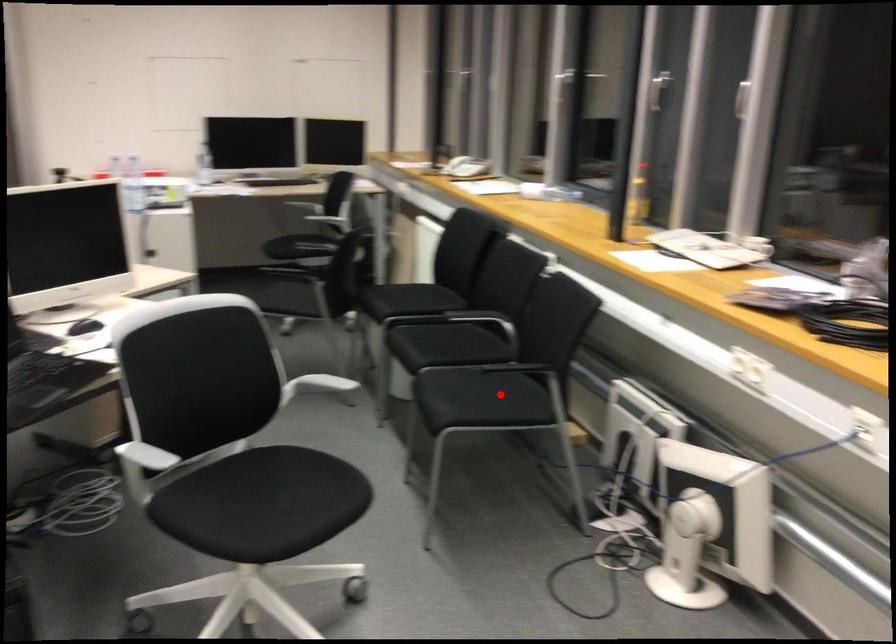
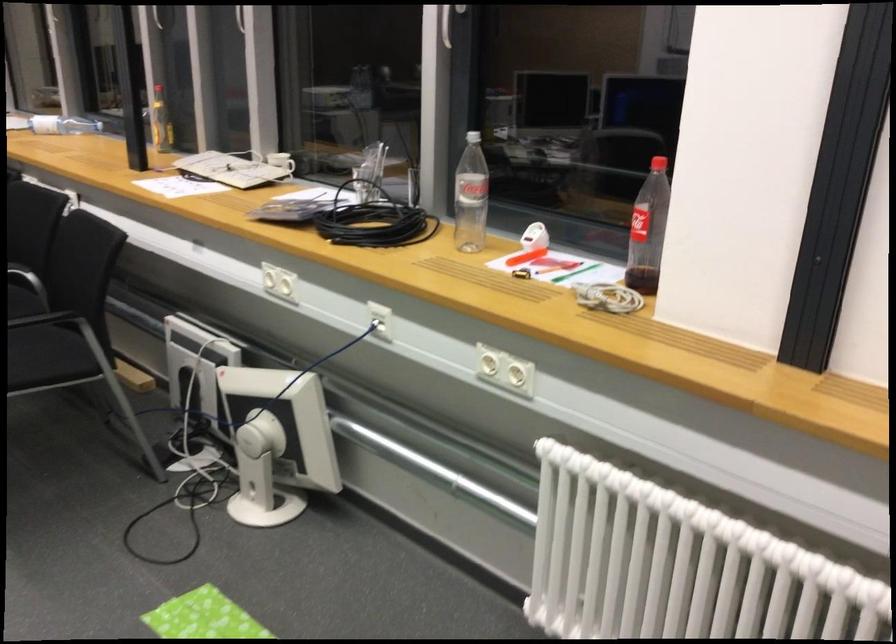
Find the pixel in the second image that matches the highlighted location in the first image.

(47, 357)